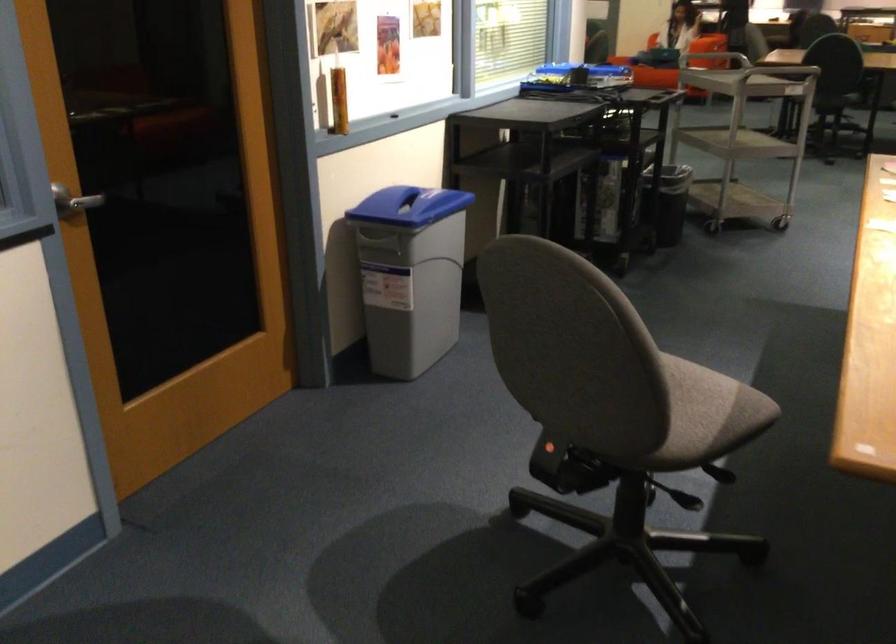
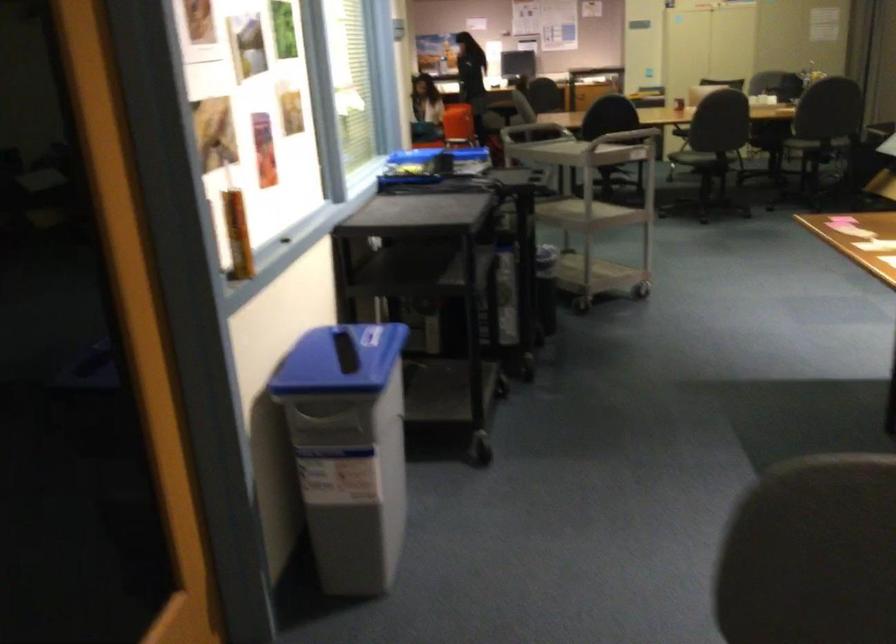
Question: The camera is either moving clockwise (left) or counter-clockwise (right) around the object. The first image is from the beginning of the video and the second image is from the end. Is the camera moving left or right when shooting the video?

Choices:
 (A) Left
 (B) Right

Answer: (A)